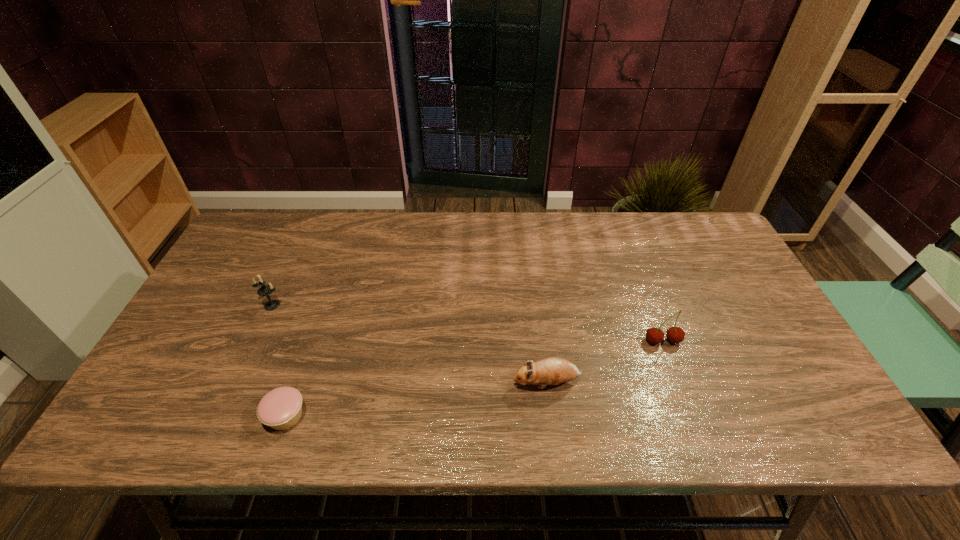
Where is `blank space at the near left corner of the desktop`? The width and height of the screenshot is (960, 540). blank space at the near left corner of the desktop is located at coordinates (158, 432).

The image size is (960, 540). In order to click on blank area at the far right corner in this screenshot , I will do `click(711, 240)`.

What are the coordinates of `vacant area at the near right corner of the desktop` in the screenshot? It's located at [x=801, y=423].

Identify the location of unoccupied area between the rightmost object and the leftmost object. The height and width of the screenshot is (540, 960). 468,323.

This screenshot has height=540, width=960. In order to click on free space between the candle holder and the second shortest object in this screenshot , I will do `click(409, 344)`.

Where is `vacant space in between the second farthest object and the nearest object`? This screenshot has height=540, width=960. vacant space in between the second farthest object and the nearest object is located at coordinates (474, 379).

Identify the location of blank region between the candle holder and the cupcake. (279, 361).

You are a GUI agent. You are given a task and a screenshot of the screen. Output one action in this format:
    pyautogui.click(x=<x>, y=<y>)
    Task: Click on the empty location between the second nearest object and the rightmost object
    
    Given the screenshot: What is the action you would take?
    pyautogui.click(x=605, y=362)

At what (x,y) coordinates should I click in order to perform the action: click on free spot between the candle holder and the third object from right to left. Please return your answer as a coordinate pair (x, y). The image size is (960, 540). Looking at the image, I should click on (279, 361).

You are a GUI agent. You are given a task and a screenshot of the screen. Output one action in this format:
    pyautogui.click(x=<x>, y=<y>)
    Task: Click on the blank region between the cupcake and the hamster
    This screenshot has height=540, width=960.
    Given the screenshot: What is the action you would take?
    pyautogui.click(x=416, y=400)